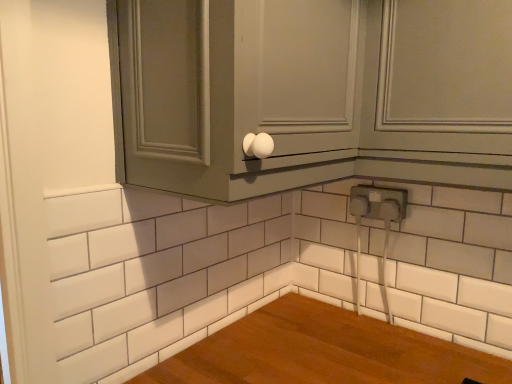
Question: Is the position of white plastic electrical outlet at lower right less distant than that of matte gray cabinet at upper center?

Choices:
 (A) yes
 (B) no

Answer: (B)

Question: From the image's perspective, does white plastic electrical outlet at lower right appear higher than matte gray cabinet at upper center?

Choices:
 (A) no
 (B) yes

Answer: (A)

Question: Is matte gray cabinet at upper center inside white plastic electrical outlet at lower right?

Choices:
 (A) no
 (B) yes

Answer: (A)

Question: Is white plastic electrical outlet at lower right smaller than matte gray cabinet at upper center?

Choices:
 (A) yes
 (B) no

Answer: (A)

Question: Does white plastic electrical outlet at lower right have a greater width compared to matte gray cabinet at upper center?

Choices:
 (A) no
 (B) yes

Answer: (A)

Question: Is white plastic electrical outlet at lower right spatially inside matte gray cabinet at upper right, or outside of it?

Choices:
 (A) outside
 (B) inside

Answer: (A)

Question: From the image's perspective, relative to matte gray cabinet at upper right, is white plastic electrical outlet at lower right above or below?

Choices:
 (A) above
 (B) below

Answer: (B)

Question: Is white plastic electrical outlet at lower right taller or shorter than matte gray cabinet at upper right?

Choices:
 (A) tall
 (B) short

Answer: (B)

Question: Looking at the image, does white plastic electrical outlet at lower right seem bigger or smaller compared to matte gray cabinet at upper right?

Choices:
 (A) big
 (B) small

Answer: (B)

Question: From a real-world perspective, is matte gray cabinet at upper center above or below matte gray cabinet at upper right?

Choices:
 (A) above
 (B) below

Answer: (A)

Question: In terms of height, does matte gray cabinet at upper center look taller or shorter compared to matte gray cabinet at upper right?

Choices:
 (A) short
 (B) tall

Answer: (B)

Question: Looking at their shapes, would you say matte gray cabinet at upper center is wider or thinner than matte gray cabinet at upper right?

Choices:
 (A) wide
 (B) thin

Answer: (A)

Question: From the image's perspective, is matte gray cabinet at upper center above or below matte gray cabinet at upper right?

Choices:
 (A) below
 (B) above

Answer: (B)

Question: From a real-world perspective, relative to white plastic electrical outlet at lower right, is matte gray cabinet at upper right vertically above or below?

Choices:
 (A) below
 (B) above

Answer: (B)

Question: From the image's perspective, is matte gray cabinet at upper right positioned above or below white plastic electrical outlet at lower right?

Choices:
 (A) above
 (B) below

Answer: (A)